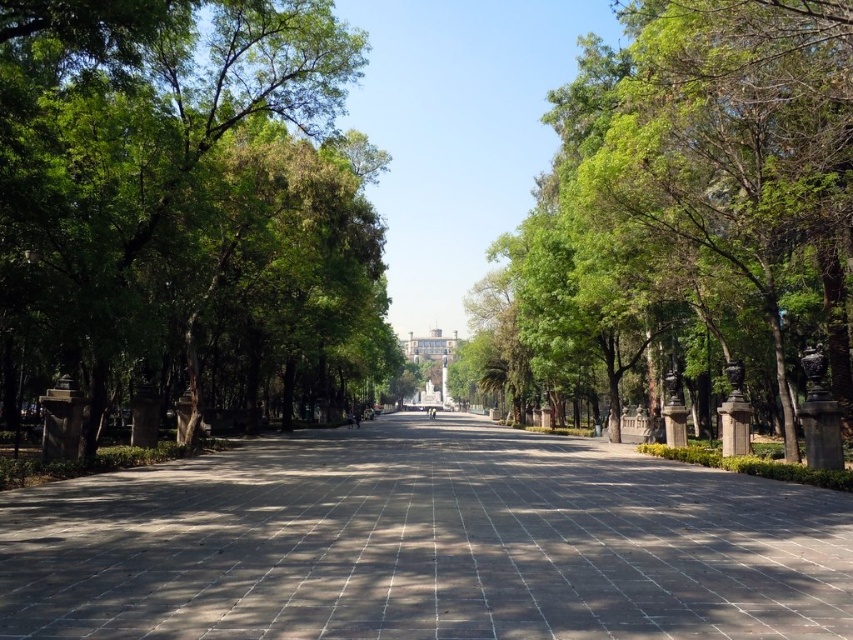
Question: Which point is closer to the camera taking this photo?

Choices:
 (A) (137, 570)
 (B) (548, 276)

Answer: (A)

Question: Is dark gray paving stone at center thinner than green leafy tree at left?

Choices:
 (A) yes
 (B) no

Answer: (A)

Question: Can you confirm if dark gray paving stone at center is bigger than green leafy tree at center?

Choices:
 (A) no
 (B) yes

Answer: (A)

Question: Is dark gray paving stone at center bigger than green leafy tree at left?

Choices:
 (A) yes
 (B) no

Answer: (B)

Question: Which point appears farthest from the camera in this image?

Choices:
 (A) (793, 48)
 (B) (775, 605)
 (C) (97, 136)

Answer: (C)

Question: Among these points, which one is farthest from the camera?

Choices:
 (A) (160, 618)
 (B) (569, 186)
 (C) (316, 168)

Answer: (B)